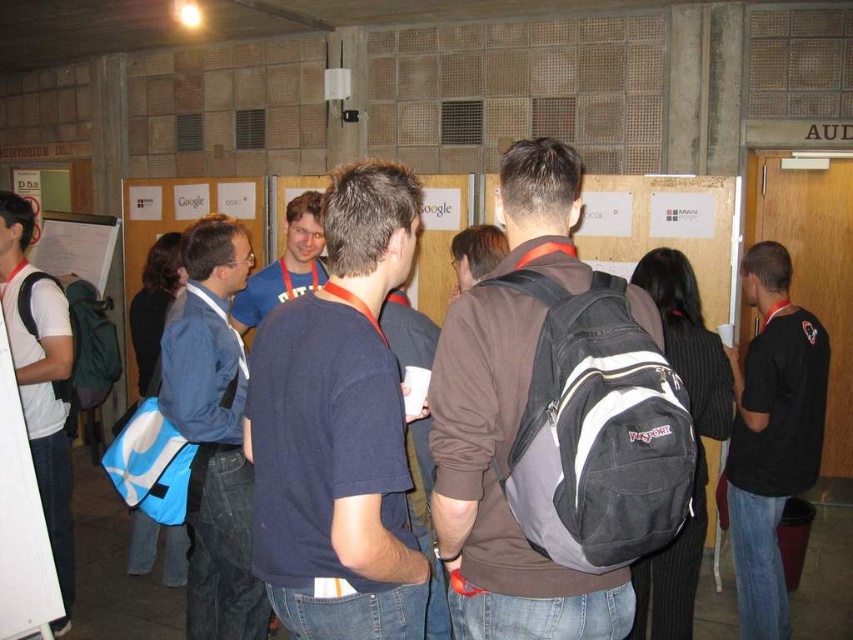
You are a person who needs to retrieve your dark brown backpack at center and gray fabric backpack at center from the conference room. The space between them is 1.02 meters. If you want to move both backpacks to a table that is 1.2 meters wide, will they fit side by side on the table?

The distance between the dark brown backpack at center and the gray fabric backpack at center is 1.02 meters. Since the table is 1.2 meters wide, which is wider than the combined space between them, both backpacks can fit side by side on the table.

You are standing at the point labeled point (329, 396). You want to reach the nearest exit, which is located 4.56 feet away from you. Can you safely walk in a straight line to the exit without any obstacles?

Yes, you can safely walk in a straight line to the exit because the distance between you and the exit is 4.56 feet, and there are no obstacles mentioned in the scene description that would block your path.